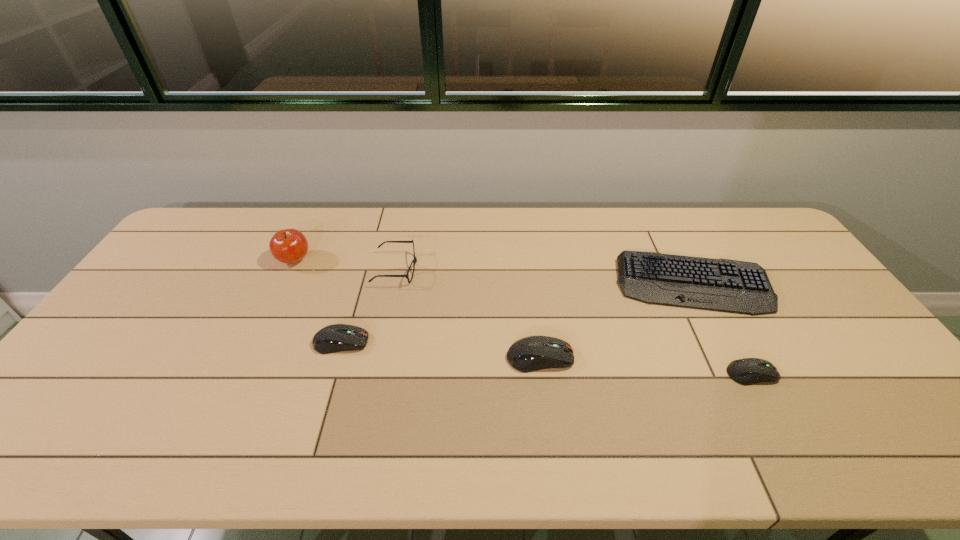
Where is `the second tallest computer equipment`? the second tallest computer equipment is located at coordinates (333, 338).

Identify the location of the third object from right to left. The width and height of the screenshot is (960, 540). (532, 353).

Where is `the shortest computer equipment`? The image size is (960, 540). the shortest computer equipment is located at coordinates (747, 371).

Where is `computer keyboard`? computer keyboard is located at coordinates (726, 285).

This screenshot has width=960, height=540. In order to click on the tallest object in this screenshot , I will do `click(289, 246)`.

Find the location of a particular element. apple is located at coordinates (289, 246).

Identify the location of spectacles. The image size is (960, 540). (414, 260).

I want to click on vacant space located on the button of the second shortest computer equipment, so click(x=427, y=342).

You are a GUI agent. You are given a task and a screenshot of the screen. Output one action in this format:
    pyautogui.click(x=<x>, y=<y>)
    Task: Click on the free region located on the button of the second computer equipment from right to left
    
    Given the screenshot: What is the action you would take?
    pyautogui.click(x=649, y=357)

The width and height of the screenshot is (960, 540). Identify the location of free space located 0.140m on the button of the rightmost computer equipment. coord(831,374).